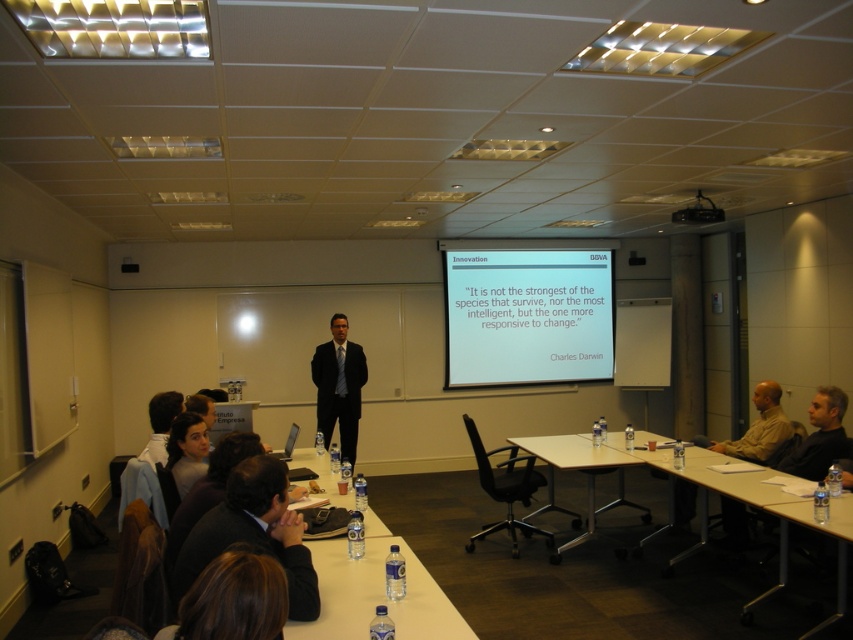
Question: Can you confirm if clear plastic water bottles at lower center is wider than black plastic projector at upper center?

Choices:
 (A) no
 (B) yes

Answer: (B)

Question: Which object appears farthest from the camera in this image?

Choices:
 (A) dark brown suit at lower center
 (B) white plastic table at lower right
 (C) white plastic table at center
 (D) clear plastic water bottles at lower center

Answer: (C)

Question: Estimate the real-world distances between objects in this image. Which object is closer to the black plastic projector at upper center?

Choices:
 (A) clear plastic water bottles at lower center
 (B) dark brown suit at lower center

Answer: (A)

Question: Is clear plastic water bottles at lower center bigger than matte black suit at center?

Choices:
 (A) no
 (B) yes

Answer: (A)

Question: Does dark brown suit at lower center have a lesser width compared to white plastic table at center?

Choices:
 (A) no
 (B) yes

Answer: (B)

Question: Which object is closer to the camera taking this photo?

Choices:
 (A) clear plastic water bottles at lower center
 (B) white matte projector screen at upper center

Answer: (A)